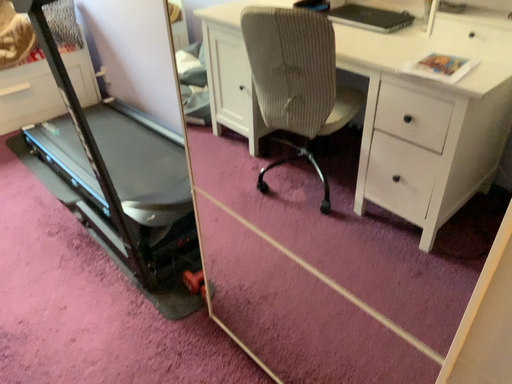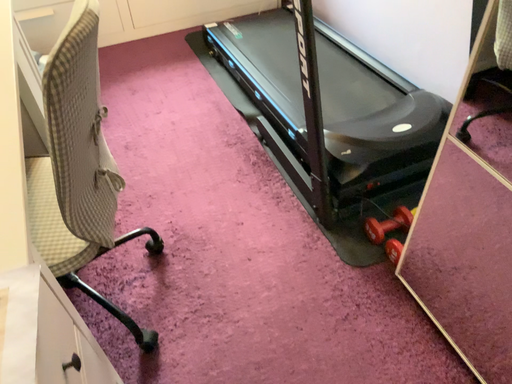
Question: How did the camera likely rotate when shooting the video?

Choices:
 (A) rotated upward
 (B) rotated downward

Answer: (B)